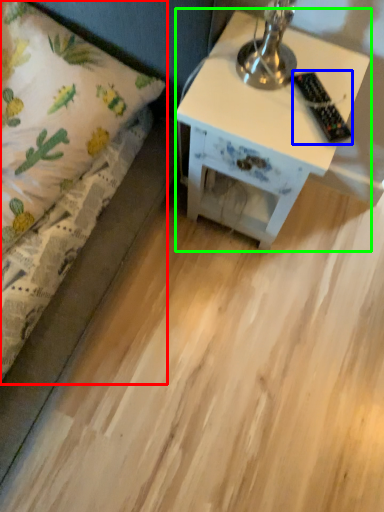
Question: Which is farther away from bed (highlighted by a red box)? remote control (highlighted by a blue box) or nightstand (highlighted by a green box)?

Choices:
 (A) remote control
 (B) nightstand

Answer: (A)